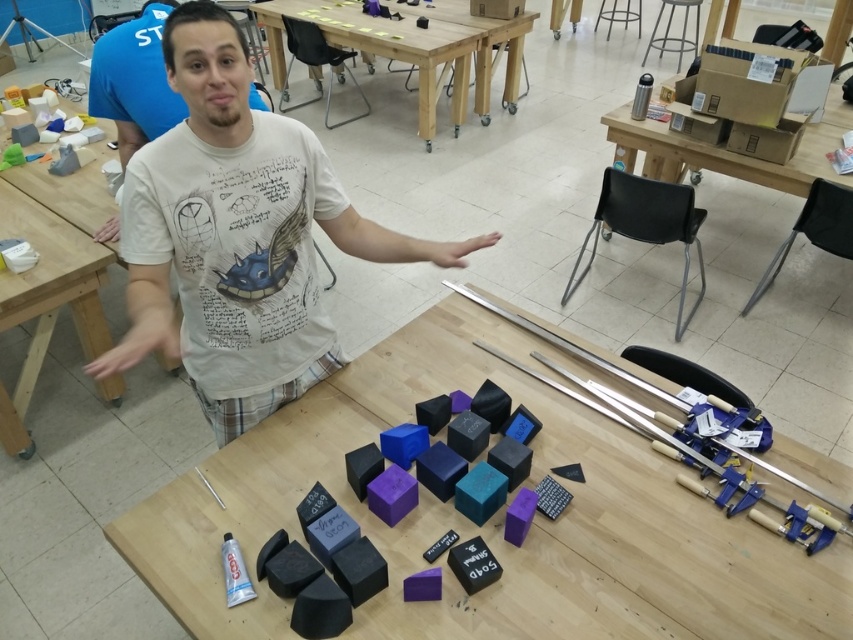
Which is above, metallic stool at upper right or skinny flesh at center?

metallic stool at upper right is higher up.

Between metallic stool at upper right and skinny flesh at center, which one appears on the left side from the viewer's perspective?

skinny flesh at center is more to the left.

The height and width of the screenshot is (640, 853). I want to click on metallic stool at upper right, so click(x=674, y=36).

Is the position of wooden table at center less distant than that of skinny flesh at center?

No, wooden table at center is further to the viewer.

Find the location of a particular element. wooden table at center is located at coordinates (381, 48).

You are a GUI agent. You are given a task and a screenshot of the screen. Output one action in this format:
    pyautogui.click(x=<x>, y=<y>)
    Task: Click on the wooden table at center
    
    Given the screenshot: What is the action you would take?
    pyautogui.click(x=381, y=48)

Consider the image. Who is shorter, matte plastic blocks at center or metallic silver thermos at upper right?

With less height is matte plastic blocks at center.

Describe the element at coordinates (486, 524) in the screenshot. This screenshot has width=853, height=640. I see `matte plastic blocks at center` at that location.

Find the location of `matte plastic blocks at center`. matte plastic blocks at center is located at coordinates (486, 524).

Where is `matte plastic blocks at center`? matte plastic blocks at center is located at coordinates (486, 524).